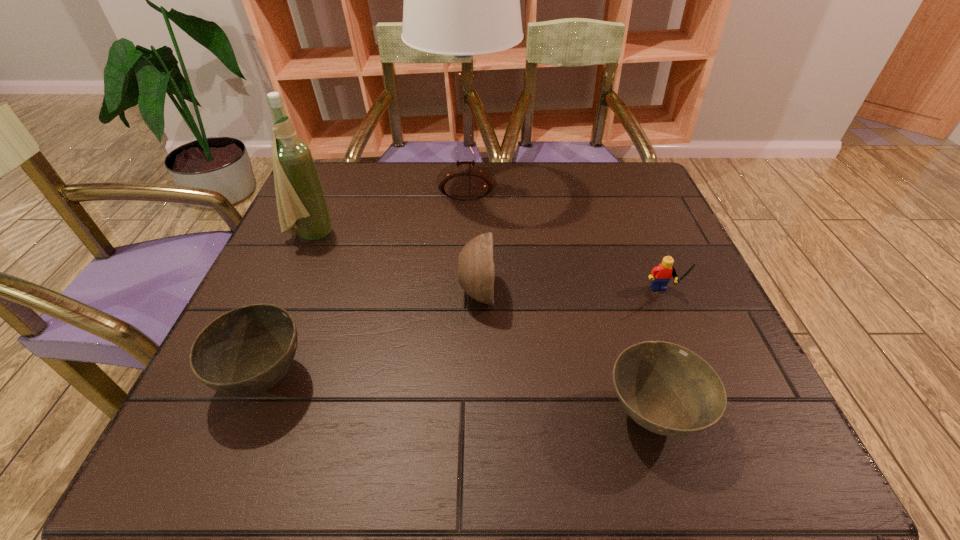
The image size is (960, 540). Identify the location of object that is at the near left corner. (247, 350).

Identify the location of object at the near right corner. The width and height of the screenshot is (960, 540). (667, 389).

Identify the location of vacant area at the far edge of the desktop. (414, 163).

Where is `blank space at the near edge of the desktop`? The image size is (960, 540). blank space at the near edge of the desktop is located at coordinates (340, 434).

The width and height of the screenshot is (960, 540). I want to click on vacant space at the left edge, so click(299, 286).

Image resolution: width=960 pixels, height=540 pixels. In the image, there is a desktop. Identify the location of vacant region at the right edge. tap(665, 226).

Where is `vacant space at the near left corner of the desktop`? The width and height of the screenshot is (960, 540). vacant space at the near left corner of the desktop is located at coordinates (247, 468).

The width and height of the screenshot is (960, 540). In order to click on vacant space at the far right corner in this screenshot , I will do `click(638, 198)`.

In order to click on free space between the table lamp and the leftmost bowl in this screenshot , I will do `click(366, 283)`.

What are the coordinates of `free space between the table lamp and the second farthest object` in the screenshot? It's located at (389, 211).